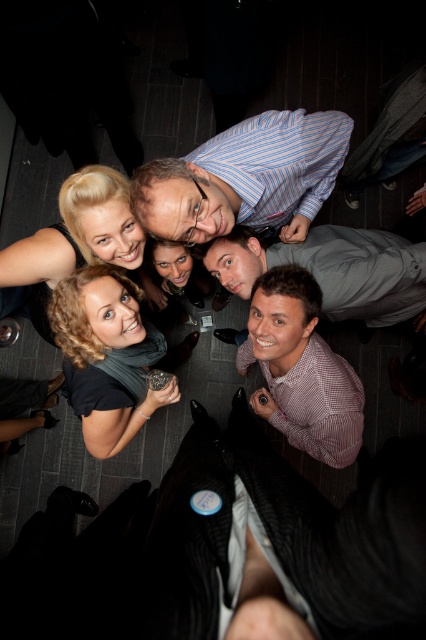
Question: Considering the real-world distances, which object is closest to the blue striped shirt at upper center?

Choices:
 (A) checkered fabric shirt at lower right
 (B) blonde hair at center
 (C) black matte scarf at center

Answer: (B)

Question: Which point is closer to the camera?

Choices:
 (A) (249, 198)
 (B) (371, 244)
 (C) (86, 227)

Answer: (C)

Question: Is black matte scarf at center to the right of blonde hair at center from the viewer's perspective?

Choices:
 (A) no
 (B) yes

Answer: (B)

Question: Is checkered fabric shirt at lower right wider than gray fabric shirt at center?

Choices:
 (A) yes
 (B) no

Answer: (B)

Question: Can you confirm if black matte scarf at center is thinner than blonde hair at center?

Choices:
 (A) no
 (B) yes

Answer: (B)

Question: Estimate the real-world distances between objects in this image. Which object is closer to the blue striped shirt at upper center?

Choices:
 (A) blonde hair at center
 (B) gray fabric shirt at center
 (C) black matte scarf at center

Answer: (B)